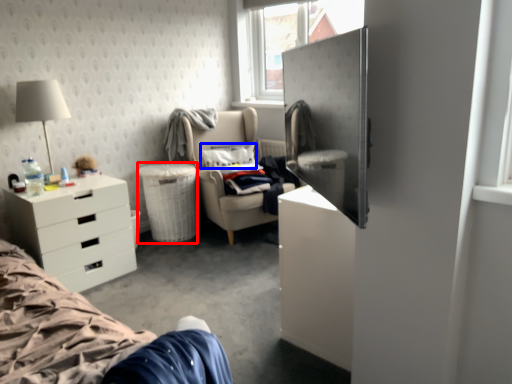
Question: Among these objects, which one is farthest to the camera, trash bin/can (highlighted by a red box) or pillow (highlighted by a blue box)?

Choices:
 (A) trash bin/can
 (B) pillow

Answer: (B)